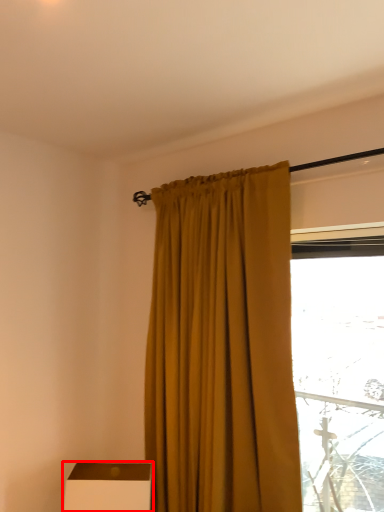
Question: Considering the relative positions of furniture (annotated by the red box) and curtain in the image provided, where is furniture (annotated by the red box) located with respect to the staircase?

Choices:
 (A) right
 (B) left

Answer: (B)